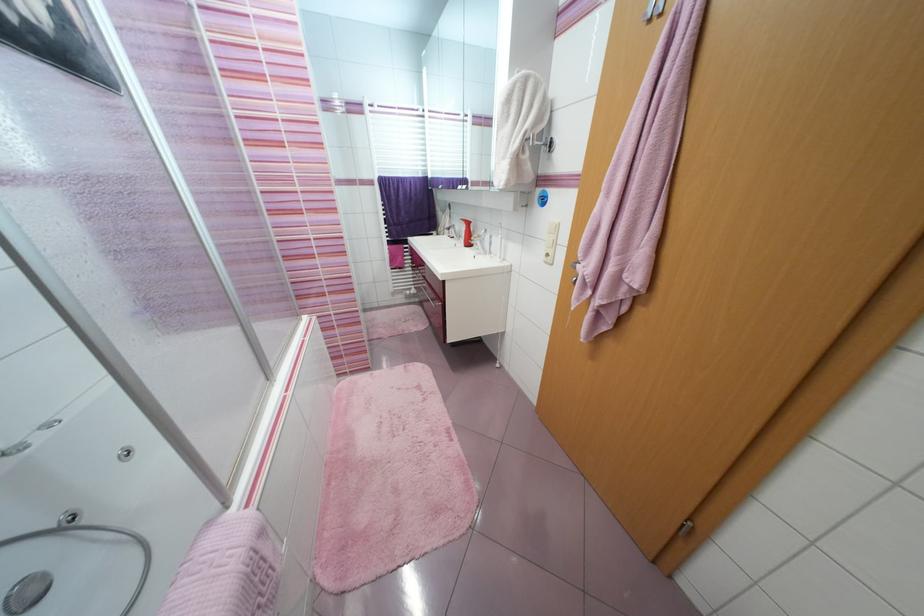
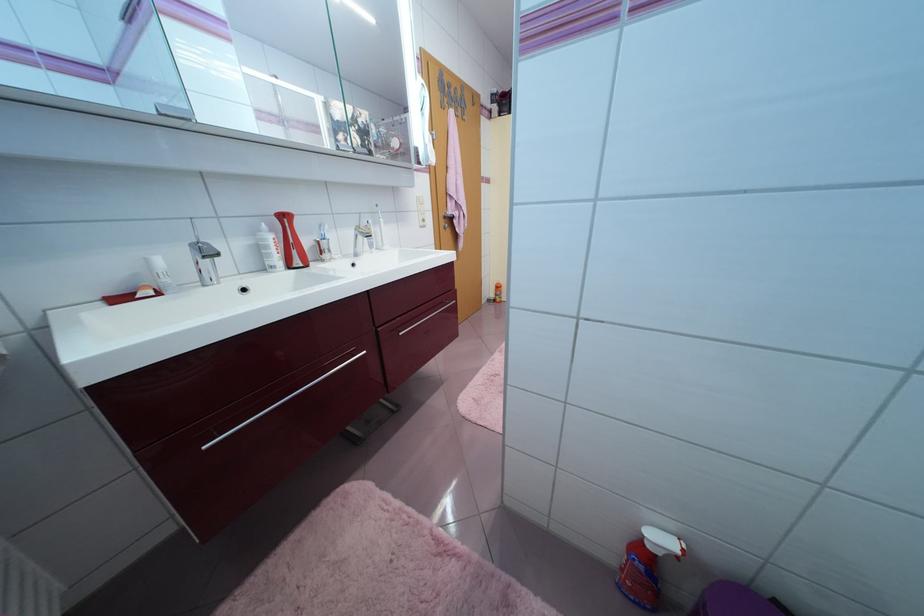
Question: I am providing you with two images of the same scene from different viewpoints. Which of the following objects are not visible in image2?

Choices:
 (A) over-door towel hook
 (B) dryer control knob
 (C) faucet lever
 (D) red toothbrush holder

Answer: (A)